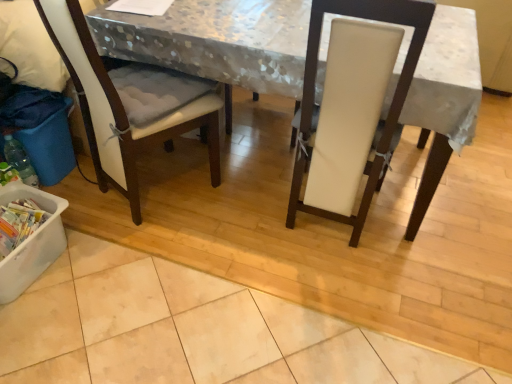
The width and height of the screenshot is (512, 384). In order to click on vacant area that is in front of white leather chair at center, the second chair when ordered from left to right in this screenshot , I will do `click(335, 293)`.